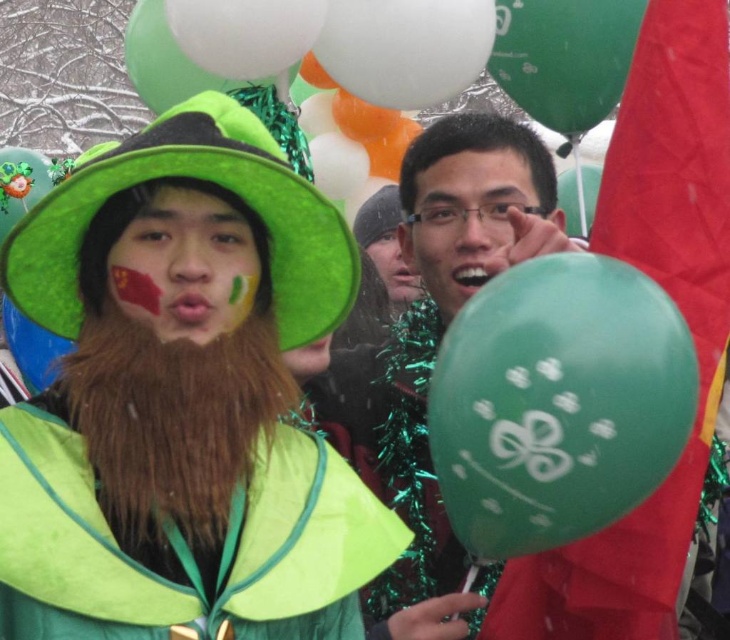
Question: Among these objects, which one is farthest from the camera?

Choices:
 (A) brown fuzzy beard at center
 (B) green glossy balloon at center
 (C) green matte balloon at right
 (D) smooth skin face at center

Answer: (D)

Question: Does green matte balloon at right appear under matte green balloon at center?

Choices:
 (A) yes
 (B) no

Answer: (B)

Question: Observing the image, what is the correct spatial positioning of green matte balloon at upper center in reference to smooth skin face at center?

Choices:
 (A) above
 (B) below

Answer: (A)

Question: Which object is the farthest from the matte green balloon at center?

Choices:
 (A) glossy plastic balloon at center
 (B) green matte balloon at upper center

Answer: (A)

Question: Can you confirm if brown fuzzy beard at center is positioned to the right of matte black glasses at center?

Choices:
 (A) yes
 (B) no

Answer: (B)

Question: Considering the real-world distances, which object is closest to the matte green hat at center?

Choices:
 (A) brown fuzzy beard at center
 (B) green matte balloon at upper center
 (C) smooth skin face at center

Answer: (A)